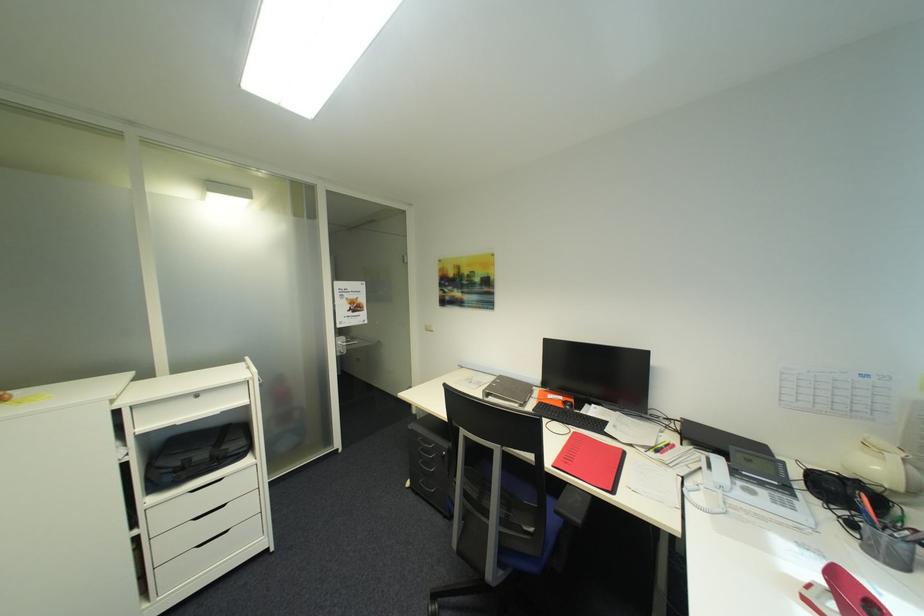
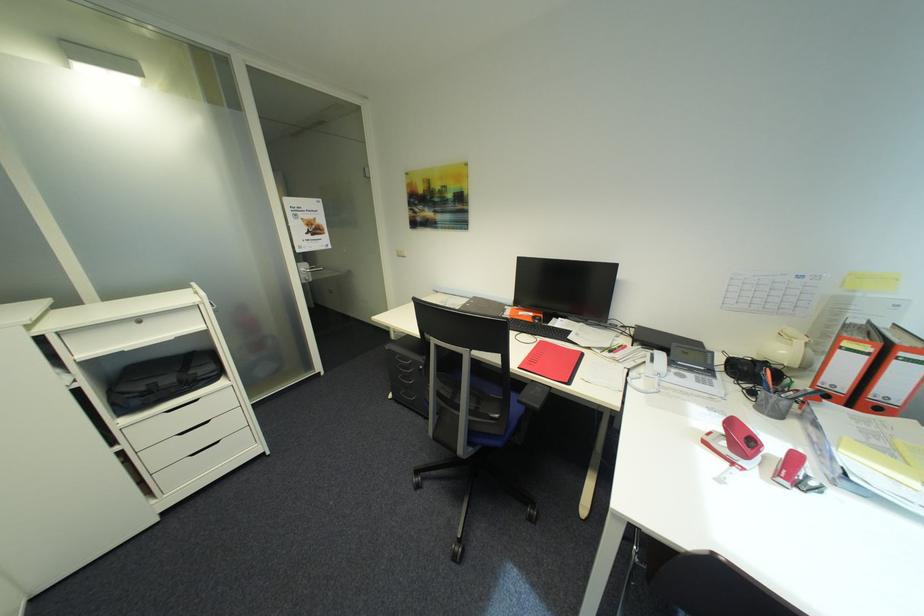
Locate, in the second image, the point that corresponds to the point at 429,463 in the first image.

(408, 378)